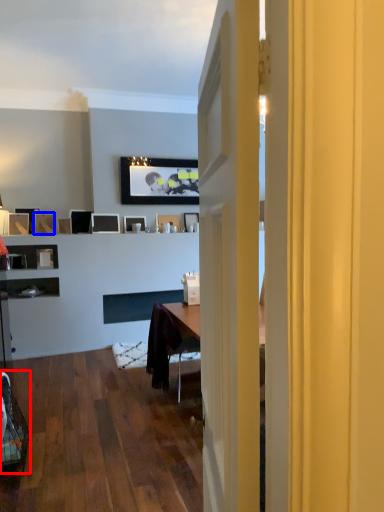
Question: Which object appears farthest to the camera in this image, swivel chair (highlighted by a red box) or picture frame (highlighted by a blue box)?

Choices:
 (A) swivel chair
 (B) picture frame

Answer: (B)